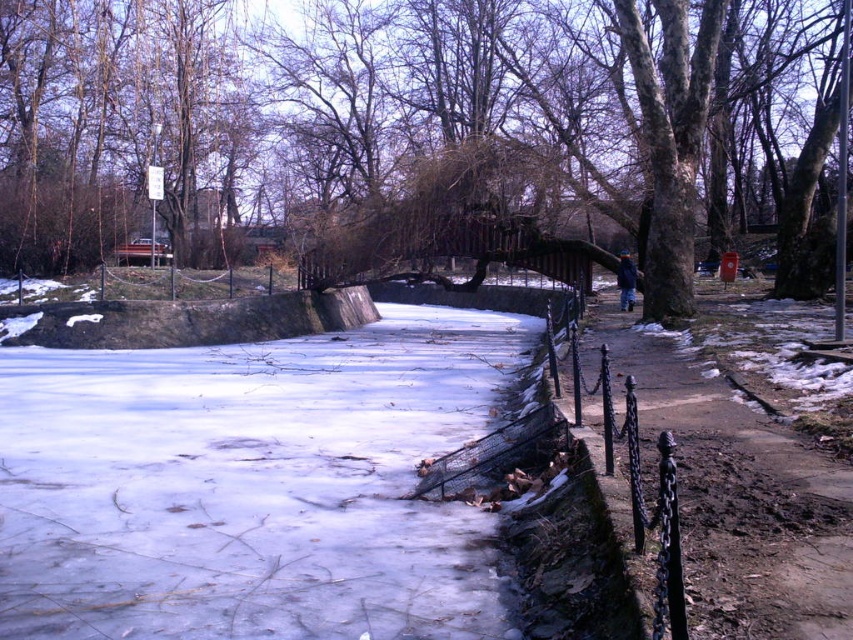
Question: Is brown textured tree at center to the right of black wrought iron fence at lower right from the viewer's perspective?

Choices:
 (A) yes
 (B) no

Answer: (A)

Question: Considering the real-world distances, which object is farthest from the brown textured tree at center?

Choices:
 (A) black wrought iron fence at lower right
 (B) black wrought iron fence at right

Answer: (B)

Question: Which point is farther to the camera?

Choices:
 (A) (659, 621)
 (B) (825, 461)

Answer: (B)

Question: Is brown textured tree at center smaller than black wrought iron fence at lower right?

Choices:
 (A) yes
 (B) no

Answer: (B)

Question: Which object is positioned farthest from the black wrought iron fence at right?

Choices:
 (A) black wrought iron fence at lower right
 (B) brown textured tree at center

Answer: (B)

Question: Can you confirm if brown textured tree at center is positioned above black wrought iron fence at right?

Choices:
 (A) yes
 (B) no

Answer: (A)